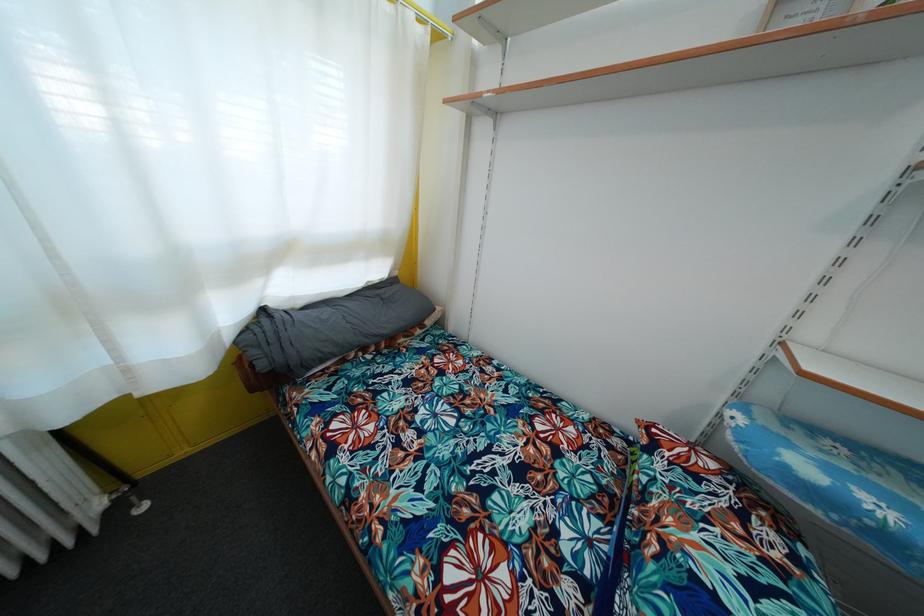
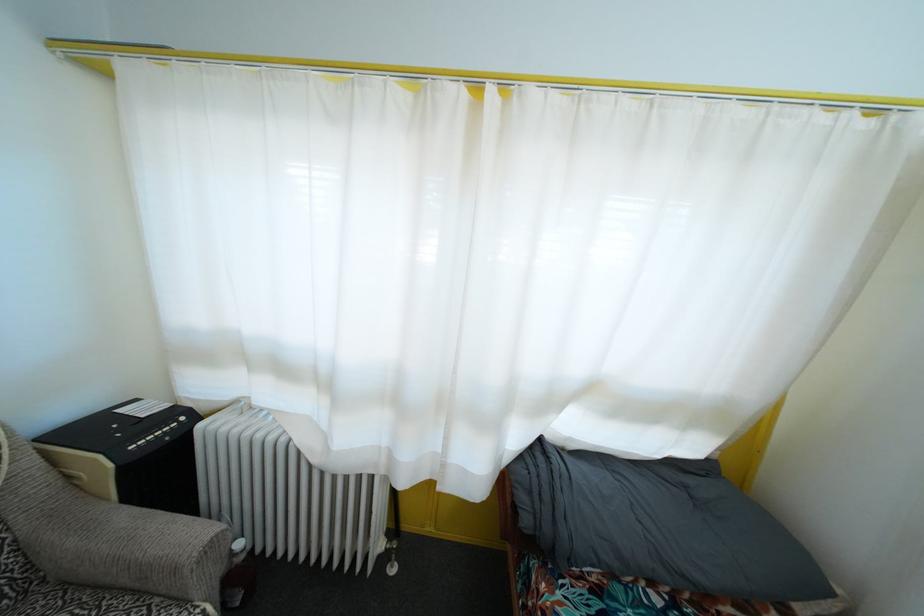
Question: The first image is from the beginning of the video and the second image is from the end. How did the camera likely rotate when shooting the video?

Choices:
 (A) Left
 (B) Right
 (C) Up
 (D) Down

Answer: (A)